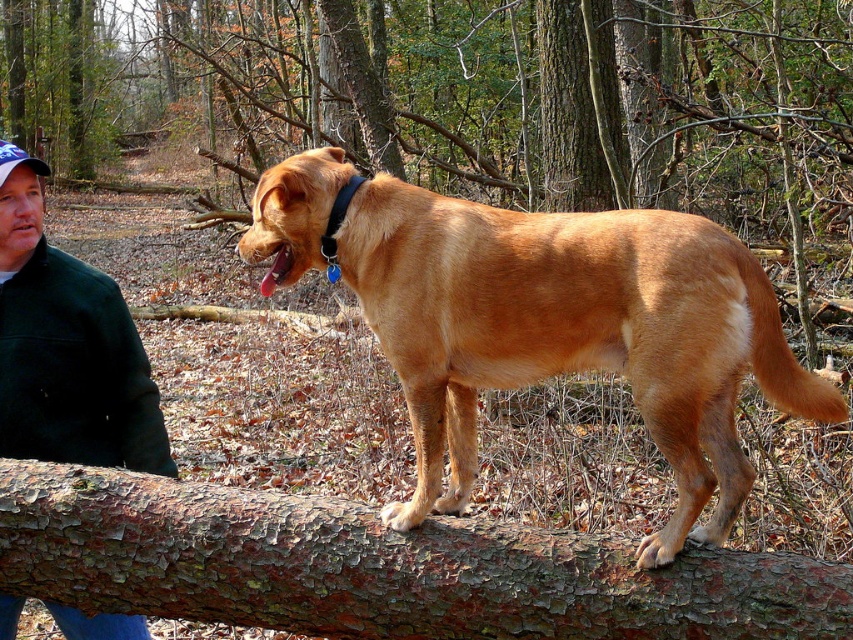
You are navigating through the wooded area and need to place a marker at point (461, 28) and another at point (688, 564). According to the scene, which point is closer to the front of the image?

Point (688, 564) is closer to the front of the image because point (461, 28) is behind it.

You are a hiker who just finished a trail and is looking for your belongings. You see the green fleece jacket at left and the black leather collar at upper center. Which item is taller?

The green fleece jacket at left is taller than the black leather collar at upper center.

What is the relationship between the width of the brown rough bark tree trunk at center and the brown rough bark at center in the image?

The brown rough bark tree trunk at center is wider than the brown rough bark at center.